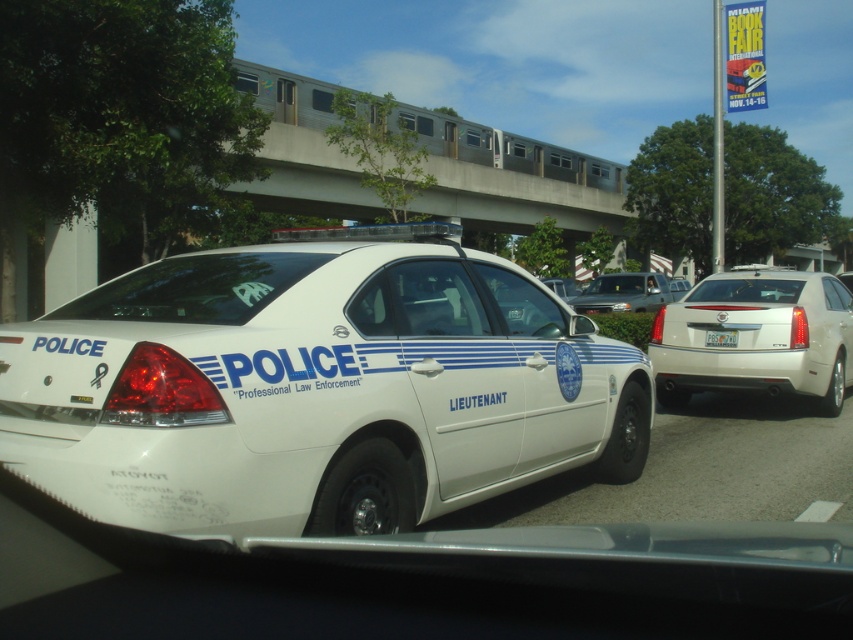
Can you confirm if white glossy police car at center is positioned below white glossy sedan at center?

Yes.

Who is positioned more to the right, white glossy police car at center or white glossy sedan at center?

From the viewer's perspective, white glossy sedan at center appears more on the right side.

Identify the location of white glossy police car at center. (315, 387).

Locate an element on the screen. white glossy police car at center is located at coordinates (315, 387).

Between point (305, 266) and point (706, 346), which one is positioned behind?

Point (706, 346)

Between white glossy police car at center and white plastic license plate at center, which one appears on the right side from the viewer's perspective?

From the viewer's perspective, white plastic license plate at center appears more on the right side.

Image resolution: width=853 pixels, height=640 pixels. Find the location of `white glossy police car at center`. white glossy police car at center is located at coordinates (315, 387).

At what (x,y) coordinates should I click in order to perform the action: click on white glossy police car at center. Please return your answer as a coordinate pair (x, y). Looking at the image, I should click on click(315, 387).

Can you confirm if white glossy police car at center is bigger than metallic silver suv at center?

No, white glossy police car at center is not bigger than metallic silver suv at center.

Which is more to the left, white glossy police car at center or metallic silver suv at center?

white glossy police car at center is more to the left.

Who is more forward, (x=413, y=353) or (x=622, y=294)?

Point (x=413, y=353) is more forward.

You are a GUI agent. You are given a task and a screenshot of the screen. Output one action in this format:
    pyautogui.click(x=<x>, y=<y>)
    Task: Click on the white glossy police car at center
    The height and width of the screenshot is (640, 853).
    Given the screenshot: What is the action you would take?
    pyautogui.click(x=315, y=387)